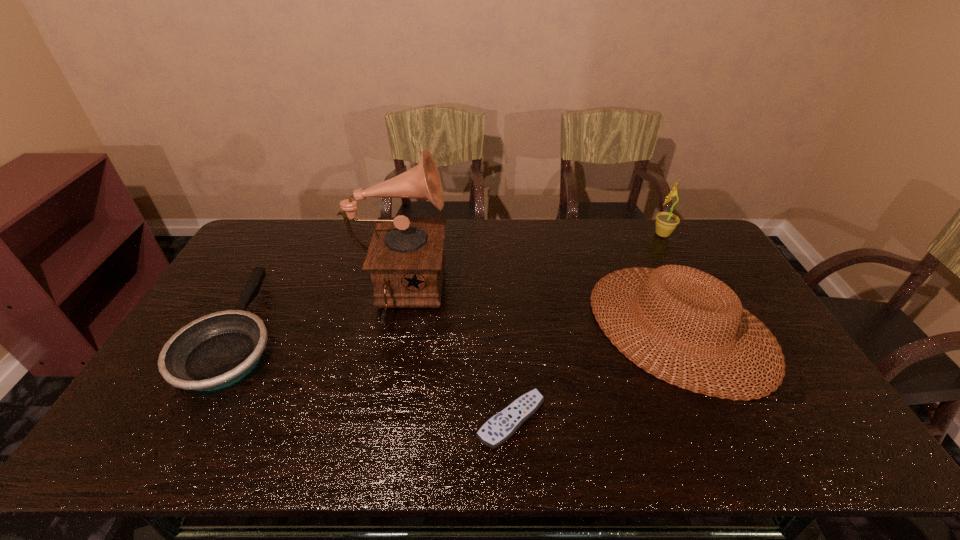
You are a GUI agent. You are given a task and a screenshot of the screen. Output one action in this format:
    pyautogui.click(x=<x>, y=<y>)
    Task: Click on the second object from left to right
    This screenshot has height=540, width=960.
    Given the screenshot: What is the action you would take?
    pyautogui.click(x=405, y=258)

Identify the location of record player. (405, 258).

The width and height of the screenshot is (960, 540). In order to click on the farthest object in this screenshot , I will do `click(666, 222)`.

This screenshot has height=540, width=960. Find the location of `sunflower`. sunflower is located at coordinates (666, 222).

At what (x,y) coordinates should I click in order to perform the action: click on the third tallest object. Please return your answer as a coordinate pair (x, y). Image resolution: width=960 pixels, height=540 pixels. Looking at the image, I should click on (733, 313).

Locate an element on the screen. The width and height of the screenshot is (960, 540). frying pan is located at coordinates (217, 350).

Locate an element on the screen. Image resolution: width=960 pixels, height=540 pixels. the fourth tallest object is located at coordinates (217, 350).

Find the location of a particular element. This screenshot has width=960, height=540. the third object from right to left is located at coordinates (500, 427).

The height and width of the screenshot is (540, 960). Find the location of `remote control`. remote control is located at coordinates (500, 427).

This screenshot has width=960, height=540. Find the location of `vacant space located on the horn of the second object from left to right`. vacant space located on the horn of the second object from left to right is located at coordinates (574, 296).